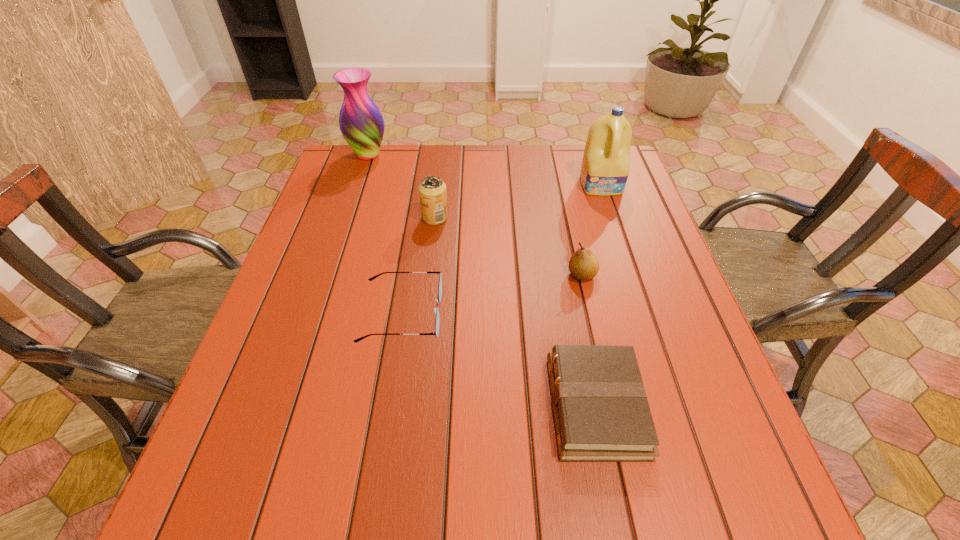
Locate an element on the screen. This screenshot has width=960, height=540. vase is located at coordinates (361, 122).

Locate an element on the screen. The width and height of the screenshot is (960, 540). the farthest object is located at coordinates click(x=361, y=122).

The width and height of the screenshot is (960, 540). I want to click on detergent, so click(x=605, y=168).

The image size is (960, 540). I want to click on the fifth nearest object, so click(x=605, y=168).

Where is `the third tallest object`? Image resolution: width=960 pixels, height=540 pixels. the third tallest object is located at coordinates (432, 190).

You are a GUI agent. You are given a task and a screenshot of the screen. Output one action in this format:
    pyautogui.click(x=<x>, y=<y>)
    Task: Click on the beer can
    
    Given the screenshot: What is the action you would take?
    pyautogui.click(x=432, y=190)

Locate an element on the screen. This screenshot has height=540, width=960. pear is located at coordinates (584, 264).

Identify the location of spectacles. (436, 332).

At what (x,y) coordinates should I click in order to perform the action: click on the nearest object. Please return your answer as a coordinate pair (x, y). The image size is (960, 540). Looking at the image, I should click on (601, 411).

The image size is (960, 540). Identify the location of vacant area situated 0.100m on the front of the farthest object. (358, 185).